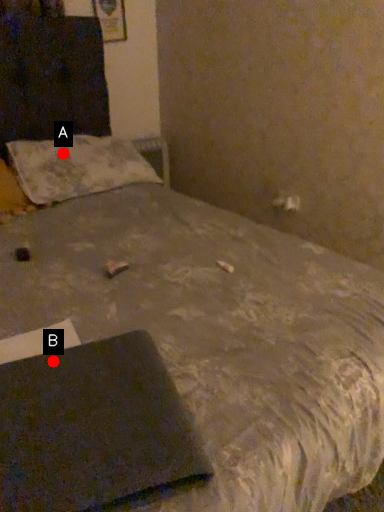
Question: Two points are circled on the image, labeled by A and B beside each circle. Which point is farther from the camera taking this photo?

Choices:
 (A) A is further
 (B) B is further

Answer: (A)